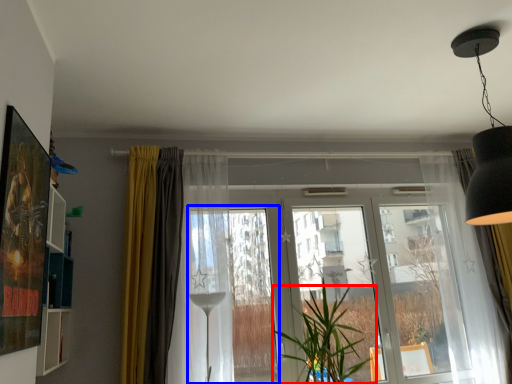
Question: Among these objects, which one is farthest to the camera, houseplant (highlighted by a red box) or window frame (highlighted by a blue box)?

Choices:
 (A) houseplant
 (B) window frame

Answer: (B)